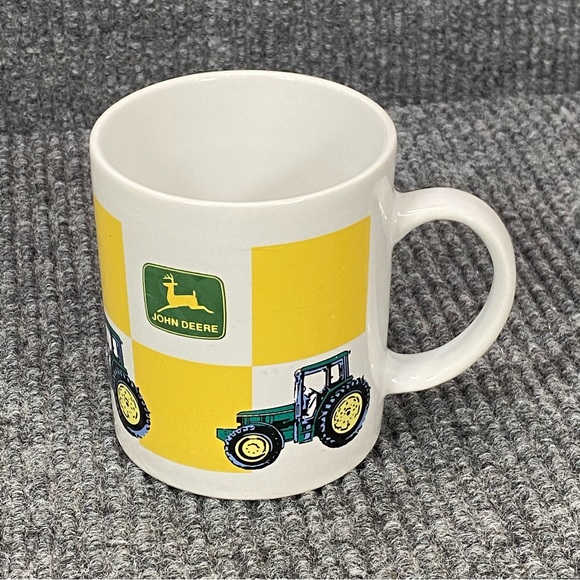
Where is `mug`? Image resolution: width=580 pixels, height=580 pixels. mug is located at coordinates (220, 347).